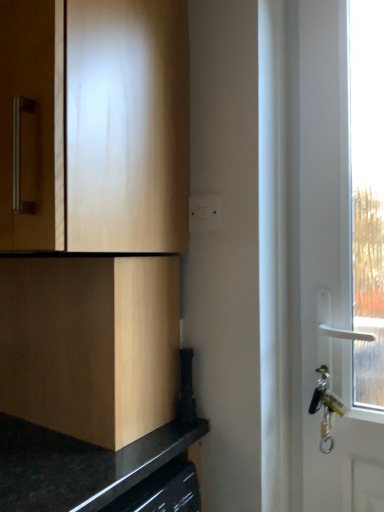
Question: Could you tell me if light wood cabinet at upper left, the second cabinetry in the bottom-to-top sequence, is turned towards white plastic switch at center?

Choices:
 (A) yes
 (B) no

Answer: (B)

Question: Does light wood cabinet at upper left, marked as the 1th cabinetry in a top-to-bottom arrangement, come in front of white plastic switch at center?

Choices:
 (A) no
 (B) yes

Answer: (B)

Question: Is light wood cabinet at upper left, marked as the 1th cabinetry in a top-to-bottom arrangement, beside white plastic switch at center?

Choices:
 (A) yes
 (B) no

Answer: (B)

Question: From the image's perspective, is light wood cabinet at upper left, marked as the 1th cabinetry in a top-to-bottom arrangement, located beneath white plastic switch at center?

Choices:
 (A) yes
 (B) no

Answer: (B)

Question: Does light wood cabinet at upper left, marked as the 1th cabinetry in a top-to-bottom arrangement, appear on the left side of white plastic switch at center?

Choices:
 (A) no
 (B) yes

Answer: (B)

Question: Is light wood cabinet at upper left, the second cabinetry in the bottom-to-top sequence, smaller than white plastic switch at center?

Choices:
 (A) yes
 (B) no

Answer: (B)

Question: From a real-world perspective, does matte wood cabinet at lower left, acting as the 2th cabinetry starting from the top, stand above white plastic switch at center?

Choices:
 (A) no
 (B) yes

Answer: (A)

Question: Is matte wood cabinet at lower left, acting as the 2th cabinetry starting from the top, outside white plastic switch at center?

Choices:
 (A) yes
 (B) no

Answer: (A)

Question: Does matte wood cabinet at lower left, acting as the 2th cabinetry starting from the top, turn towards white plastic switch at center?

Choices:
 (A) yes
 (B) no

Answer: (B)

Question: Can you confirm if matte wood cabinet at lower left, acting as the 2th cabinetry starting from the top, is shorter than white plastic switch at center?

Choices:
 (A) yes
 (B) no

Answer: (B)

Question: Is white plastic switch at center located within matte wood cabinet at lower left, which is counted as the first cabinetry, starting from the bottom?

Choices:
 (A) yes
 (B) no

Answer: (B)

Question: Considering the relative sizes of matte wood cabinet at lower left, acting as the 2th cabinetry starting from the top, and white plastic switch at center in the image provided, is matte wood cabinet at lower left, acting as the 2th cabinetry starting from the top, taller than white plastic switch at center?

Choices:
 (A) yes
 (B) no

Answer: (A)

Question: Could matte wood cabinet at lower left, acting as the 2th cabinetry starting from the top, be considered to be inside white plastic switch at center?

Choices:
 (A) no
 (B) yes

Answer: (A)